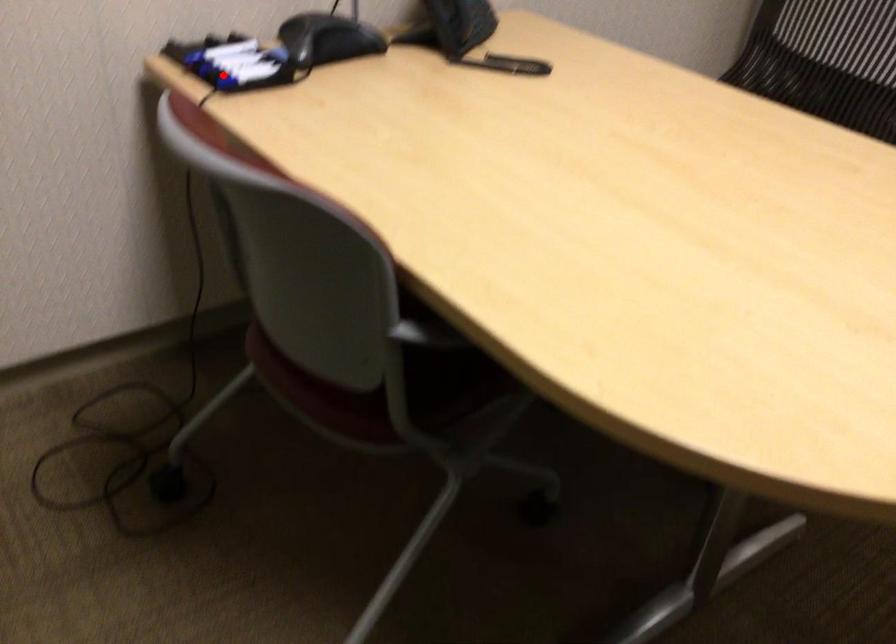
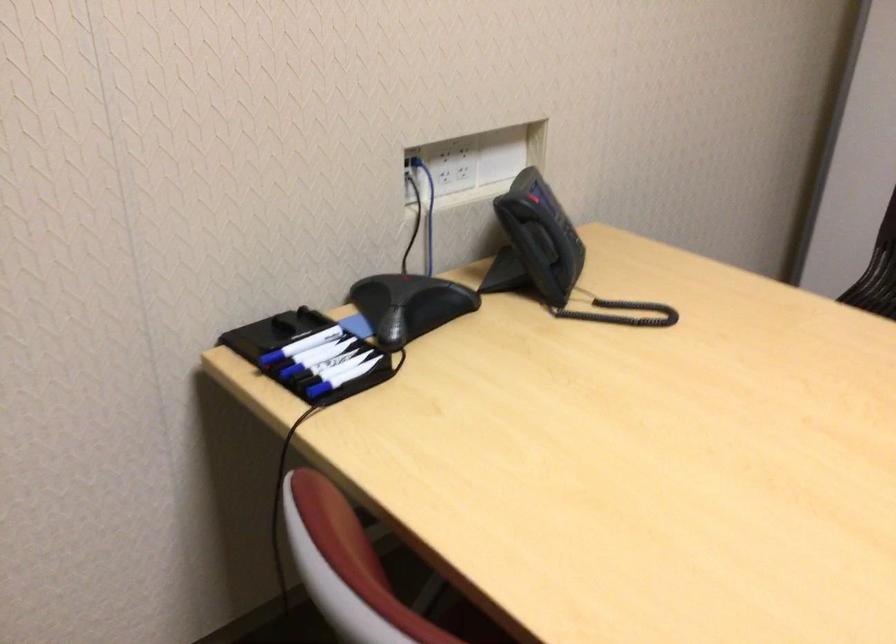
Find the pixel in the second image that matches the highlighted location in the first image.

(307, 379)